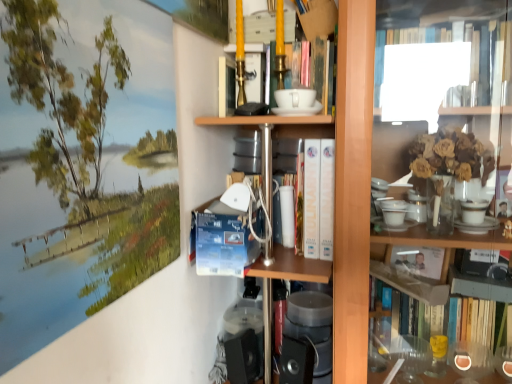
Identify the location of wooden bookcase at center. Image resolution: width=512 pixels, height=384 pixels. (353, 187).

The image size is (512, 384). What do you see at coordinates (353, 187) in the screenshot?
I see `wooden bookcase at center` at bounding box center [353, 187].

Based on the photo, what is the approximate width of wooden bookcase at center?

17.78 inches.

Describe the element at coordinates (313, 191) in the screenshot. This screenshot has width=512, height=384. I see `white paperback books at center` at that location.

What is the approximate width of white paperback books at center?

It is 9.04 inches.

Where is `white paperback books at center`? This screenshot has width=512, height=384. white paperback books at center is located at coordinates (313, 191).

Where is `wooden bookcase at center`? This screenshot has width=512, height=384. wooden bookcase at center is located at coordinates (353, 187).

In the scene shown: Which is more to the left, wooden bookcase at center or white paperback books at center?

Positioned to the left is white paperback books at center.

Which object is closer to the camera taking this photo, wooden bookcase at center or white paperback books at center?

wooden bookcase at center is more forward.

Considering the points (345, 89) and (327, 168), which point is in front, point (345, 89) or point (327, 168)?

The point (345, 89) is in front.

From the image's perspective, would you say wooden bookcase at center is positioned over white paperback books at center?

No.

From a real-world perspective, who is located lower, wooden bookcase at center or white paperback books at center?

In real-world perspective, wooden bookcase at center is lower.

Is wooden bookcase at center thinner than white paperback books at center?

Incorrect, the width of wooden bookcase at center is not less than that of white paperback books at center.

Which of these two, wooden bookcase at center or white paperback books at center, stands taller?

With more height is wooden bookcase at center.

Does wooden bookcase at center have a smaller size compared to white paperback books at center?

Incorrect, wooden bookcase at center is not smaller in size than white paperback books at center.

Is white paperback books at center located within wooden bookcase at center?

Absolutely, white paperback books at center is inside wooden bookcase at center.

Are wooden bookcase at center and white paperback books at center far apart?

They are positioned close to each other.

Consider the image. Could you tell me if wooden bookcase at center is turned towards white paperback books at center?

Yes, wooden bookcase at center is oriented towards white paperback books at center.

Based on the photo, how many degrees apart are the facing directions of wooden bookcase at center and white paperback books at center?

wooden bookcase at center and white paperback books at center are facing 1.35 degrees away from each other.

The image size is (512, 384). I want to click on bookcase that is in front of the white paperback books at center, so click(353, 187).

Considering the relative positions of white paperback books at center and wooden bookcase at center in the image provided, is white paperback books at center to the right of wooden bookcase at center from the viewer's perspective?

In fact, white paperback books at center is to the left of wooden bookcase at center.

Is white paperback books at center positioned behind wooden bookcase at center?

Yes, it is behind wooden bookcase at center.

Does point (326, 188) come closer to viewer compared to point (362, 247)?

No.

From the image's perspective, which is below, white paperback books at center or wooden bookcase at center?

From the image's view, wooden bookcase at center is below.

From a real-world perspective, is white paperback books at center on wooden bookcase at center?

Correct, in the physical world, white paperback books at center is higher than wooden bookcase at center.

Considering the sizes of white paperback books at center and wooden bookcase at center in the image, is white paperback books at center wider or thinner than wooden bookcase at center?

In the image, white paperback books at center appears to be more narrow than wooden bookcase at center.

Between white paperback books at center and wooden bookcase at center, which one has less height?

With less height is white paperback books at center.

In terms of size, does white paperback books at center appear bigger or smaller than wooden bookcase at center?

Considering their sizes, white paperback books at center takes up less space than wooden bookcase at center.

Can wooden bookcase at center be found inside white paperback books at center?

No, white paperback books at center does not contain wooden bookcase at center.

Are white paperback books at center and wooden bookcase at center far apart?

No, there isn't a large distance between white paperback books at center and wooden bookcase at center.

Is white paperback books at center oriented towards wooden bookcase at center?

Yes, white paperback books at center is facing wooden bookcase at center.

How many degrees apart are the facing directions of white paperback books at center and wooden bookcase at center?

white paperback books at center and wooden bookcase at center are facing 1.35 degrees away from each other.

How much distance is there between white paperback books at center and wooden bookcase at center?

They are 13.38 centimeters apart.

Where is `bookcase that is below the white paperback books at center (from the image's perspective)`? The width and height of the screenshot is (512, 384). bookcase that is below the white paperback books at center (from the image's perspective) is located at coordinates (353, 187).

Find the location of `bookcase in front of the white paperback books at center`. bookcase in front of the white paperback books at center is located at coordinates (353, 187).

The image size is (512, 384). Identify the location of bookcase lying on the right of white paperback books at center. (353, 187).